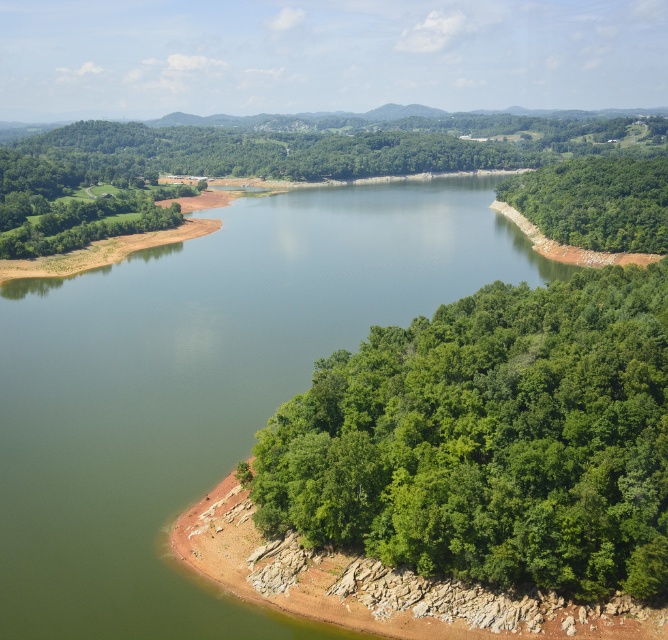
Question: Which object is the farthest from the green leafy trees at right?

Choices:
 (A) green leafy forest at lower right
 (B) green smooth water at center

Answer: (A)

Question: Does green leafy forest at lower right appear on the right side of green leafy trees at right?

Choices:
 (A) no
 (B) yes

Answer: (A)

Question: Can you confirm if green leafy forest at lower right is smaller than green leafy trees at right?

Choices:
 (A) no
 (B) yes

Answer: (B)

Question: Does green smooth water at center have a smaller size compared to green leafy trees at right?

Choices:
 (A) yes
 (B) no

Answer: (B)

Question: Which point is farther to the camera?

Choices:
 (A) (609, 200)
 (B) (405, 211)

Answer: (B)

Question: Which of the following is the closest to the observer?

Choices:
 (A) (178, 456)
 (B) (601, 548)

Answer: (B)